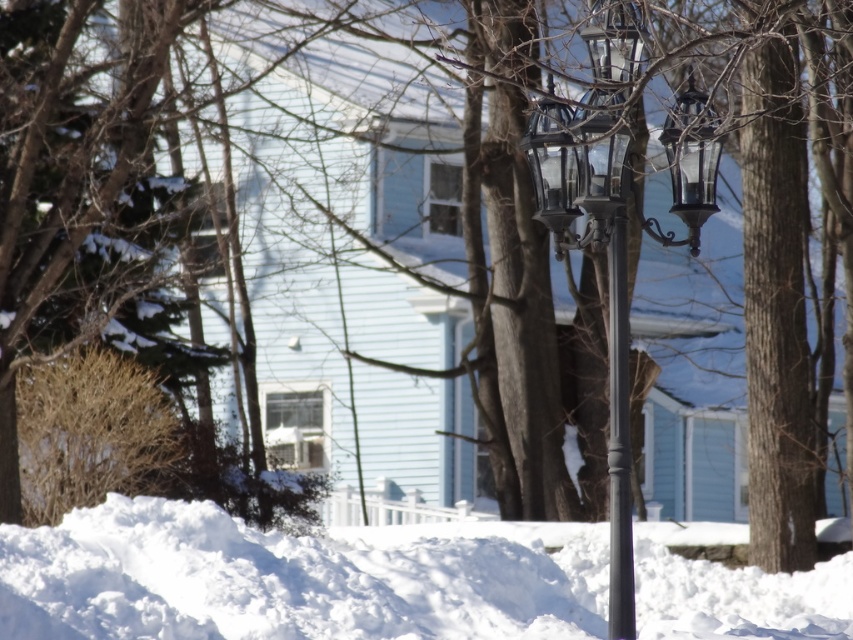
You are standing at the base of the black lamppost with three ornate, vintage style lanterns in the winter scene. You want to walk towards the light blue house with white trim. Which direction should you head to avoid stepping on the white fluffy snow at lower center located at point (x=296, y=577)?

To avoid stepping on the white fluffy snow at lower center located at point (x=296, y=577), you should head in a direction away from that point. Since the snow is at lower center, moving towards the upper part of the scene towards the house would help you avoid it.